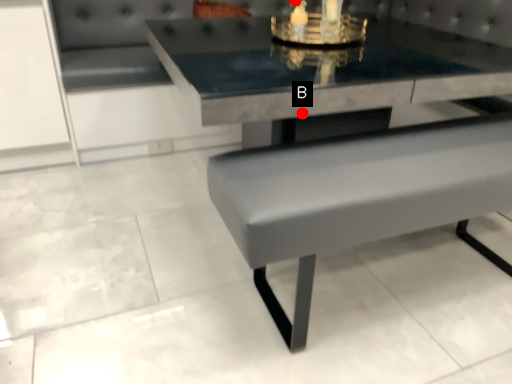
Question: Two points are circled on the image, labeled by A and B beside each circle. Which point is closer to the camera taking this photo?

Choices:
 (A) A is closer
 (B) B is closer

Answer: (B)